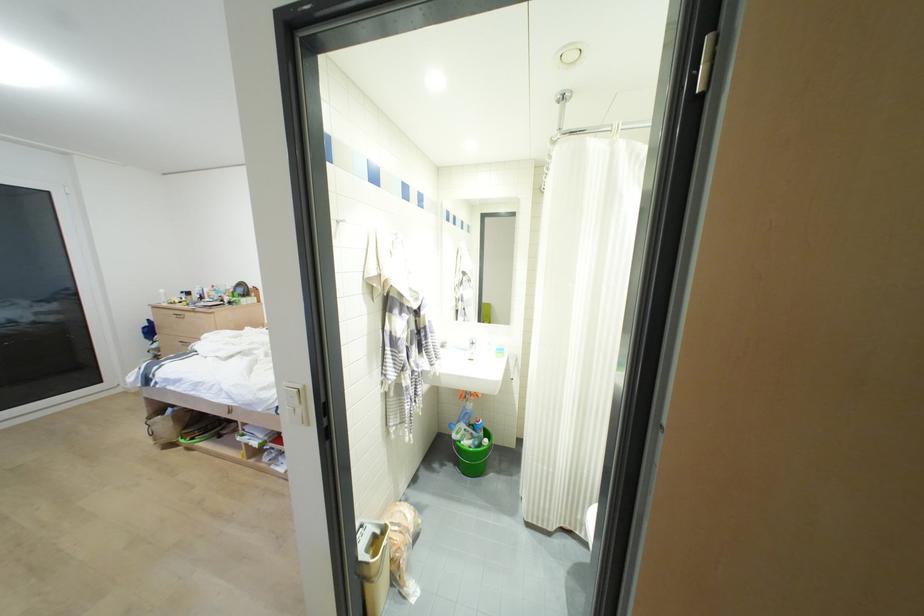
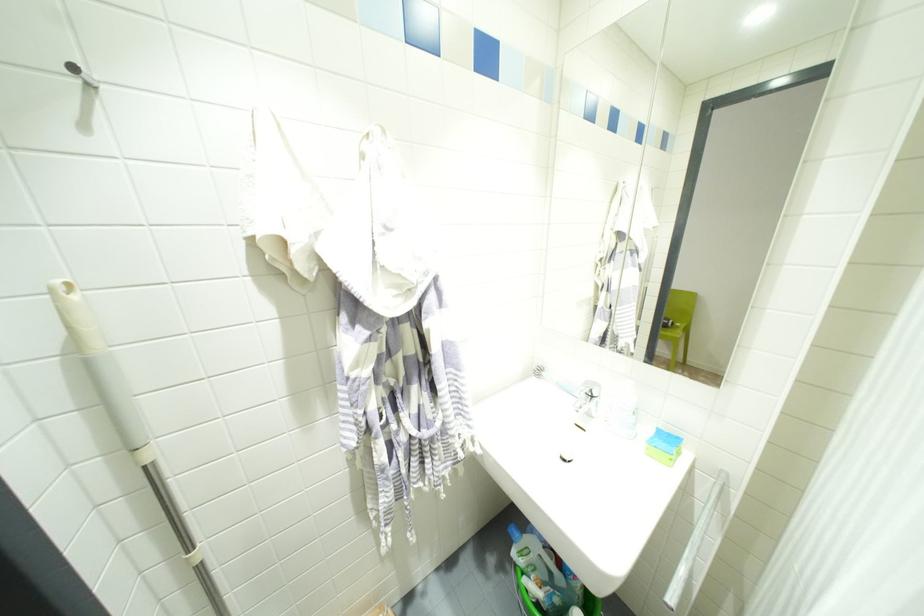
Where in the second image is the point corresponding to point 471,353 from the first image?

(589, 415)